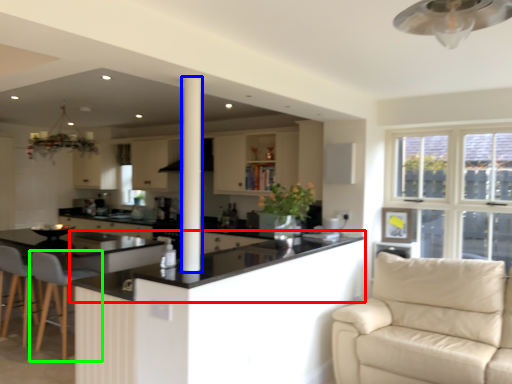
Question: Estimate the real-world distances between objects in this image. Which object is farther from countertop (highlighted by a red box), pillar (highlighted by a blue box) or chair (highlighted by a green box)?

Choices:
 (A) pillar
 (B) chair

Answer: (A)